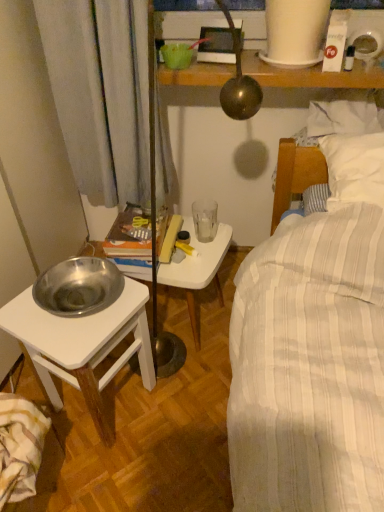
Where is `vacant space in between silver metallic bowl at left and striped cotton blanket at lower left`? Image resolution: width=384 pixels, height=512 pixels. vacant space in between silver metallic bowl at left and striped cotton blanket at lower left is located at coordinates (79, 474).